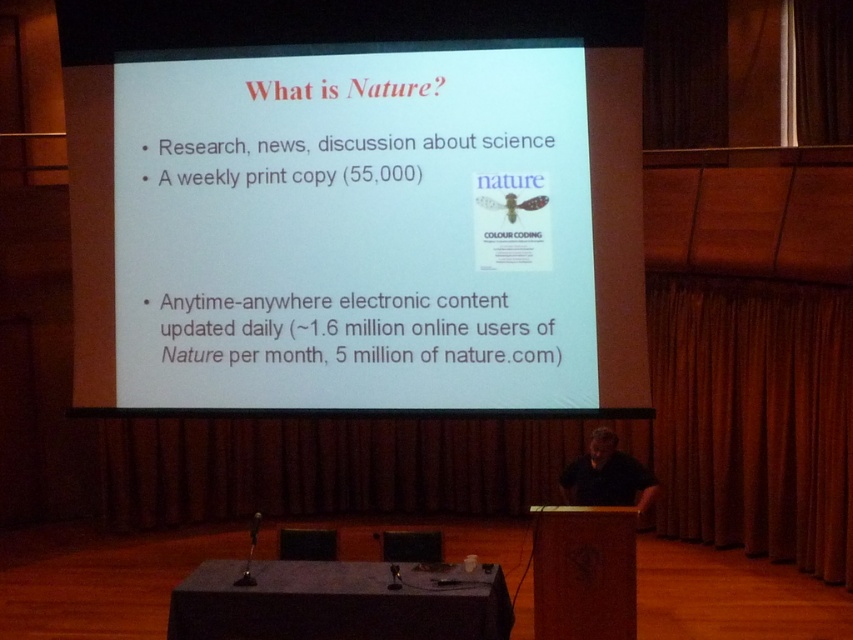
You are an attendee at the presentation and you want to take a photo of the white paper at center and the black shirt at center. Which object should you focus on first if you want to capture both in a single frame without moving the camera?

You should focus on the white paper at center first because it is above the black shirt at center, so adjusting focus to the higher object ensures both are in the frame.

Where is the white paper at center located in the coordinate system?

The white paper at center is located at point coordinates of (355,230).